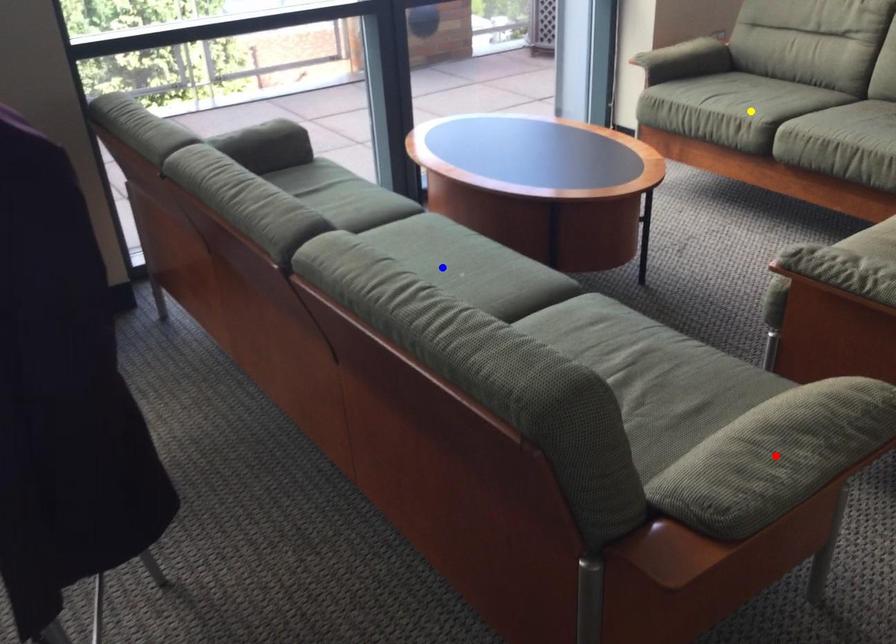
Order these from nearest to farthest:
blue point, yellow point, red point

red point < blue point < yellow point